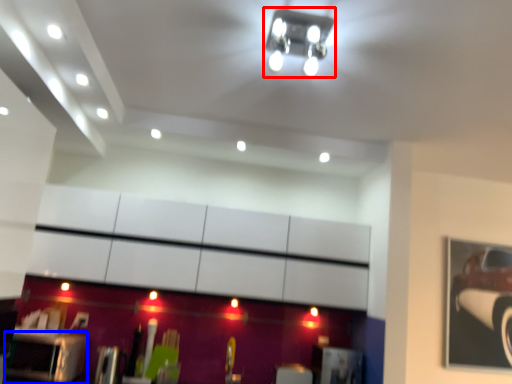
Question: Which object is closer to the camera taking this photo, light fixture (highlighted by a red box) or furniture (highlighted by a blue box)?

Choices:
 (A) light fixture
 (B) furniture

Answer: (A)